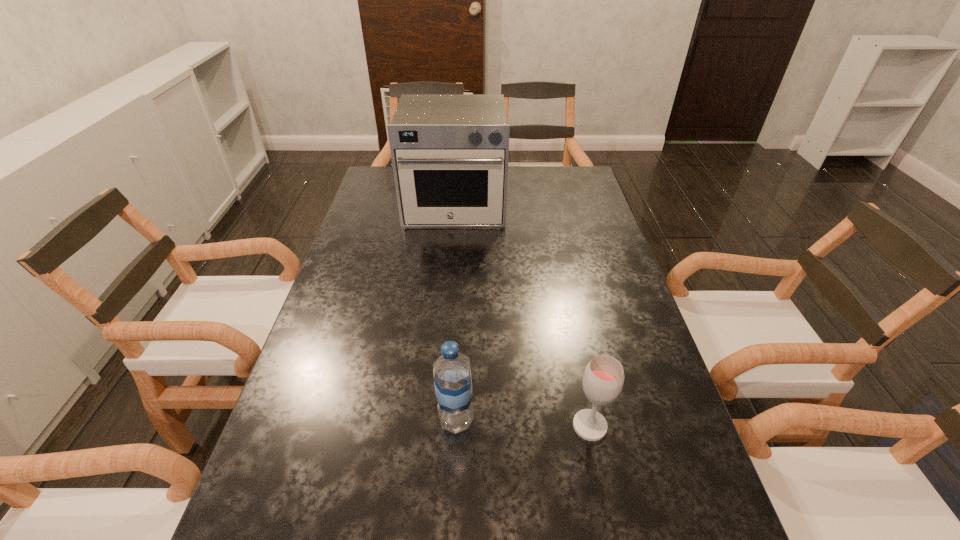
Image resolution: width=960 pixels, height=540 pixels. In order to click on object that is the second closest one to the wineglass in this screenshot , I will do `click(449, 152)`.

Find the location of a particular element. Image resolution: width=960 pixels, height=540 pixels. object that is the second closest to the tallest object is located at coordinates (603, 378).

Locate an element on the screen. The width and height of the screenshot is (960, 540). free spot that satisfies the following two spatial constraints: 1. on the front panel of the wineglass; 2. on the right side of the toaster oven is located at coordinates (437, 426).

Identify the location of vacant space that satisfies the following two spatial constraints: 1. on the label of the second tallest object; 2. on the back side of the wineglass. Image resolution: width=960 pixels, height=540 pixels. (456, 426).

In order to click on free space that satisfies the following two spatial constraints: 1. on the label of the second shortest object; 2. on the back side of the shortest object in this screenshot , I will do `click(456, 426)`.

Identify the location of free location that satisfies the following two spatial constraints: 1. on the label of the water bottle; 2. on the right side of the rightmost object. (456, 426).

At what (x,y) coordinates should I click in order to perform the action: click on free spot that satisfies the following two spatial constraints: 1. on the label of the shortest object; 2. on the left side of the water bottle. Please return your answer as a coordinate pair (x, y). The image size is (960, 540). Looking at the image, I should click on (456, 426).

At what (x,y) coordinates should I click in order to perform the action: click on vacant space that satisfies the following two spatial constraints: 1. on the label of the water bottle; 2. on the left side of the shortest object. Please return your answer as a coordinate pair (x, y). The height and width of the screenshot is (540, 960). Looking at the image, I should click on (456, 426).